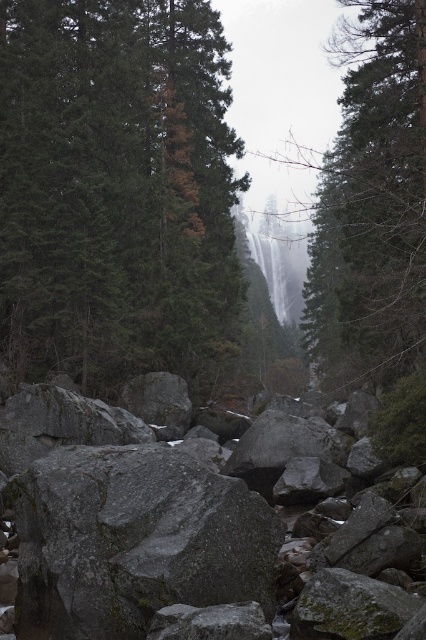
Question: Estimate the real-world distances between objects in this image. Which object is farther from the gray rough rock at center?

Choices:
 (A) gray granite rocks at lower center
 (B) green matte tree at upper left

Answer: (B)

Question: Which of the following is the farthest from the observer?

Choices:
 (A) (195, 474)
 (B) (380, 340)
 (C) (181, 513)
 (D) (11, 202)

Answer: (D)

Question: Estimate the real-world distances between objects in this image. Which object is closer to the green matte tree at upper center?

Choices:
 (A) gray granite rocks at lower center
 (B) gray rough rock at center
 (C) green matte tree at upper left

Answer: (B)

Question: Can you confirm if green matte tree at upper left is smaller than gray rough rock at center?

Choices:
 (A) yes
 (B) no

Answer: (B)

Question: Can you confirm if green matte tree at upper left is positioned below green matte tree at upper center?

Choices:
 (A) yes
 (B) no

Answer: (A)

Question: Does gray granite rocks at lower center appear under green matte tree at upper center?

Choices:
 (A) no
 (B) yes

Answer: (B)